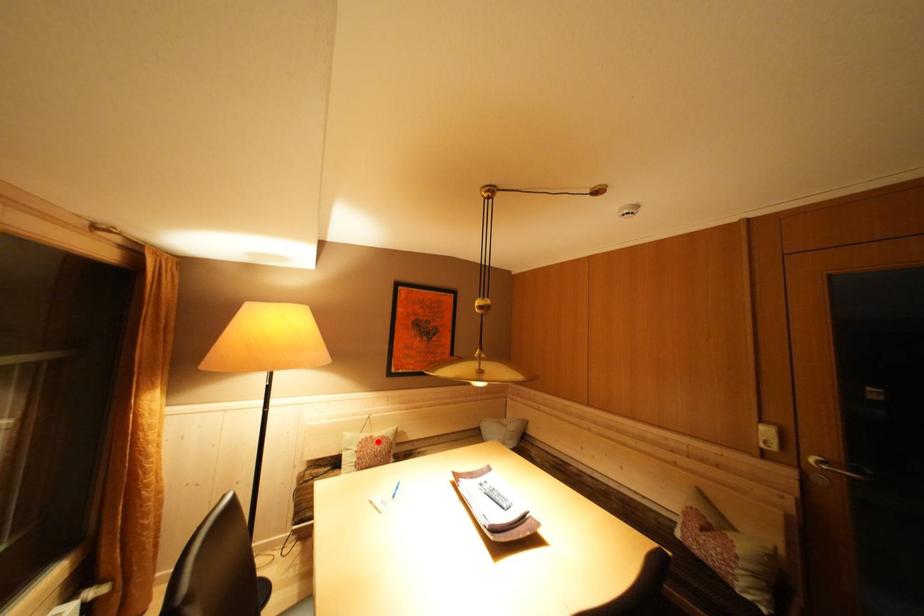
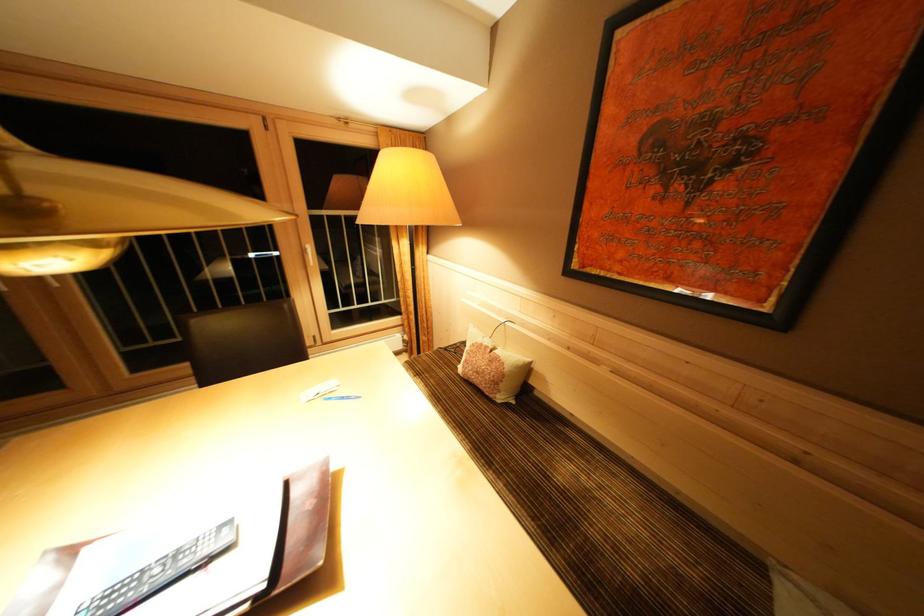
Question: I am providing you with two images of the same scene from different viewpoints. Given a red point in image1, look at the same physical point in image2. Is it:

Choices:
 (A) Closer to the viewpoint
 (B) Farther from the viewpoint

Answer: (A)